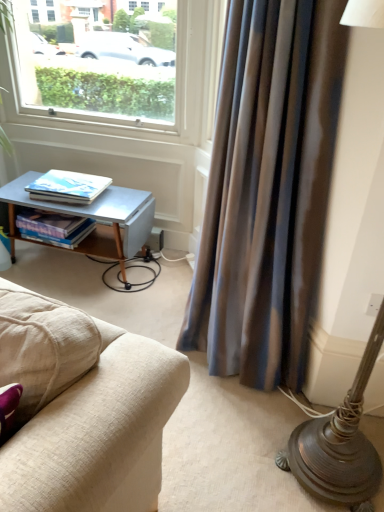
Measure the distance between point (51, 230) and camera.

Point (51, 230) is 7.46 feet from camera.

At what (x,y) coordinates should I click in order to perform the action: click on matte white book at left, which appears as the 1th book when viewed from the top. Please return your answer as a coordinate pair (x, y). This screenshot has width=384, height=512. Looking at the image, I should click on (67, 187).

From a real-world perspective, is hardcover books at lower left, which appears as the 1th book when ordered from the bottom, located beneath metallic gray table at lower left?

No, from a real-world perspective, hardcover books at lower left, which appears as the 1th book when ordered from the bottom, is not under metallic gray table at lower left.

Can you confirm if hardcover books at lower left, which is counted as the second book, starting from the top, is taller than metallic gray table at lower left?

In fact, hardcover books at lower left, which is counted as the second book, starting from the top, may be shorter than metallic gray table at lower left.

Which is behind, hardcover books at lower left, which appears as the 1th book when ordered from the bottom, or metallic gray table at lower left?

hardcover books at lower left, which appears as the 1th book when ordered from the bottom, is more distant.

Is silky blue curtain at right not close to white plastic window at upper left?

Yes, silky blue curtain at right and white plastic window at upper left are quite far apart.

From the image's perspective, would you say silky blue curtain at right is shown under white plastic window at upper left?

Indeed, from the image's perspective, silky blue curtain at right is shown beneath white plastic window at upper left.

From a real-world perspective, between silky blue curtain at right and white plastic window at upper left, who is vertically lower?

From a 3D spatial view, silky blue curtain at right is below.

Is the depth of white plastic window at upper left less than that of silky blue curtain at right?

No, it is not.

Which is behind, point (30, 59) or point (212, 353)?

Positioned behind is point (30, 59).

From the image's perspective, is white plastic window at upper left positioned above or below silky blue curtain at right?

From the image's perspective, white plastic window at upper left appears above silky blue curtain at right.

Which of these two, white plastic window at upper left or silky blue curtain at right, is bigger?

silky blue curtain at right.

Looking at this image, could you tell me if hardcover books at lower left, which is counted as the second book, starting from the top, is facing matte white book at left, which is counted as the second book, starting from the bottom?

No, hardcover books at lower left, which is counted as the second book, starting from the top, is not facing towards matte white book at left, which is counted as the second book, starting from the bottom.

Is the position of hardcover books at lower left, which appears as the 1th book when ordered from the bottom, more distant than that of matte white book at left, which appears as the 1th book when viewed from the top?

That is True.

Is hardcover books at lower left, which appears as the 1th book when ordered from the bottom, surrounding matte white book at left, which appears as the 1th book when viewed from the top?

Actually, matte white book at left, which appears as the 1th book when viewed from the top, is outside hardcover books at lower left, which appears as the 1th book when ordered from the bottom.

From a real-world perspective, is hardcover books at lower left, which appears as the 1th book when ordered from the bottom, above or below matte white book at left, which is counted as the second book, starting from the bottom?

Clearly, from a real-world perspective, hardcover books at lower left, which appears as the 1th book when ordered from the bottom, is below matte white book at left, which is counted as the second book, starting from the bottom.

Does matte white book at left, which is counted as the second book, starting from the bottom, come behind metallic gray table at lower left?

Yes.

Considering the relative sizes of matte white book at left, which appears as the 1th book when viewed from the top, and metallic gray table at lower left in the image provided, is matte white book at left, which appears as the 1th book when viewed from the top, taller than metallic gray table at lower left?

In fact, matte white book at left, which appears as the 1th book when viewed from the top, may be shorter than metallic gray table at lower left.

From a real-world perspective, between matte white book at left, which is counted as the second book, starting from the bottom, and metallic gray table at lower left, who is vertically lower?

metallic gray table at lower left, from a real-world perspective.

How different are the orientations of matte white book at left, which appears as the 1th book when viewed from the top, and metallic gray table at lower left in degrees?

matte white book at left, which appears as the 1th book when viewed from the top, and metallic gray table at lower left are facing 6.07 degrees away from each other.

In the image, is matte white book at left, which appears as the 1th book when viewed from the top, on the left side or the right side of silky blue curtain at right?

Clearly, matte white book at left, which appears as the 1th book when viewed from the top, is on the left of silky blue curtain at right in the image.

Does matte white book at left, which appears as the 1th book when viewed from the top, have a smaller size compared to silky blue curtain at right?

Yes, matte white book at left, which appears as the 1th book when viewed from the top, is smaller than silky blue curtain at right.

Is matte white book at left, which is counted as the second book, starting from the bottom, not within silky blue curtain at right?

Yes.

Would you say white plastic window at upper left is part of metallic gray table at lower left's contents?

That's incorrect, white plastic window at upper left is not inside metallic gray table at lower left.

Considering the sizes of objects metallic gray table at lower left and white plastic window at upper left in the image provided, who is wider, metallic gray table at lower left or white plastic window at upper left?

Wider between the two is metallic gray table at lower left.

Is metallic gray table at lower left beside white plastic window at upper left?

No, metallic gray table at lower left is not in contact with white plastic window at upper left.

I want to click on table located behind the white plastic window at upper left, so click(x=93, y=218).

This screenshot has height=512, width=384. Find the location of `table below the hardcover books at lower left, which appears as the 1th book when ordered from the bottom (from a real-world perspective)`. table below the hardcover books at lower left, which appears as the 1th book when ordered from the bottom (from a real-world perspective) is located at coordinates (93, 218).

Find the location of a particular element. window on the left of silky blue curtain at right is located at coordinates (119, 77).

Estimate the real-world distances between objects in this image. Which object is closer to silky blue curtain at right, matte white book at left, which appears as the 1th book when viewed from the top, or metallic gray table at lower left?

metallic gray table at lower left lies closer to silky blue curtain at right than the other object.

When comparing their distances from metallic gray table at lower left, does silky blue curtain at right or hardcover books at lower left, which is counted as the second book, starting from the top, seem further?

The object further to metallic gray table at lower left is silky blue curtain at right.

When comparing their distances from matte white book at left, which appears as the 1th book when viewed from the top, does silky blue curtain at right or metallic gray table at lower left seem further?

silky blue curtain at right.

From the picture: Estimate the real-world distances between objects in this image. Which object is closer to hardcover books at lower left, which is counted as the second book, starting from the top, silky blue curtain at right or matte white book at left, which appears as the 1th book when viewed from the top?

matte white book at left, which appears as the 1th book when viewed from the top, is closer to hardcover books at lower left, which is counted as the second book, starting from the top.

Based on their spatial positions, is white plastic window at upper left or metallic gray table at lower left closer to silky blue curtain at right?

metallic gray table at lower left is closer to silky blue curtain at right.

Looking at the image, which one is located further to metallic gray table at lower left, white plastic window at upper left or matte white book at left, which appears as the 1th book when viewed from the top?

white plastic window at upper left lies further to metallic gray table at lower left than the other object.

Based on their spatial positions, is silky blue curtain at right or matte white book at left, which appears as the 1th book when viewed from the top, further from metallic gray table at lower left?

silky blue curtain at right lies further to metallic gray table at lower left than the other object.

Considering their positions, is hardcover books at lower left, which is counted as the second book, starting from the top, positioned further to silky blue curtain at right than white plastic window at upper left?

hardcover books at lower left, which is counted as the second book, starting from the top.

In order to click on window between silky blue curtain at right and metallic gray table at lower left in the front-back direction in this screenshot , I will do `click(119, 77)`.

This screenshot has width=384, height=512. I want to click on book positioned between silky blue curtain at right and hardcover books at lower left, which appears as the 1th book when ordered from the bottom, from near to far, so click(67, 187).

You are a GUI agent. You are given a task and a screenshot of the screen. Output one action in this format:
    pyautogui.click(x=<x>, y=<y>)
    Task: Click on the book between matte white book at left, which is counted as the second book, starting from the bottom, and metallic gray table at lower left vertically
    Image resolution: width=384 pixels, height=512 pixels.
    Given the screenshot: What is the action you would take?
    pyautogui.click(x=54, y=227)

Identify the location of window between silky blue curtain at right and hardcover books at lower left, which appears as the 1th book when ordered from the bottom, from front to back. The width and height of the screenshot is (384, 512). (119, 77).